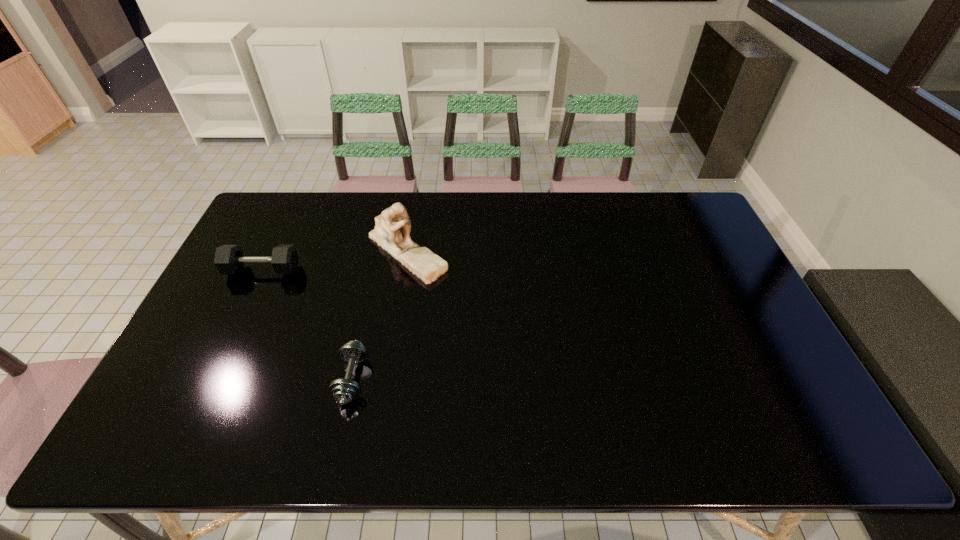
This screenshot has height=540, width=960. What are the coordinates of `free region at the far edge of the desktop` in the screenshot? It's located at (598, 198).

This screenshot has width=960, height=540. In the image, there is a desktop. Identify the location of free space at the near edge. (614, 428).

At what (x,y) coordinates should I click in order to perform the action: click on free space at the right edge of the desktop. Please return your answer as a coordinate pair (x, y). The image size is (960, 540). Looking at the image, I should click on (682, 245).

This screenshot has width=960, height=540. I want to click on free spot between the right dumbbell and the figurine, so click(380, 315).

Image resolution: width=960 pixels, height=540 pixels. Identify the location of vacant area that lies between the tallest object and the right dumbbell. (380, 315).

At what (x,y) coordinates should I click in order to perform the action: click on free space between the tallest object and the second tallest object. Please return your answer as a coordinate pair (x, y). The image size is (960, 540). Looking at the image, I should click on (335, 261).

This screenshot has width=960, height=540. I want to click on free area in between the nearest object and the left dumbbell, so click(307, 325).

The height and width of the screenshot is (540, 960). Identify the location of vacant area between the nearest object and the leftmost object. (307, 325).

Find the location of a particular element. vacant area between the figurine and the second tallest object is located at coordinates (335, 261).

Find the location of `vacant area between the left dumbbell and the figurine`. vacant area between the left dumbbell and the figurine is located at coordinates (335, 261).